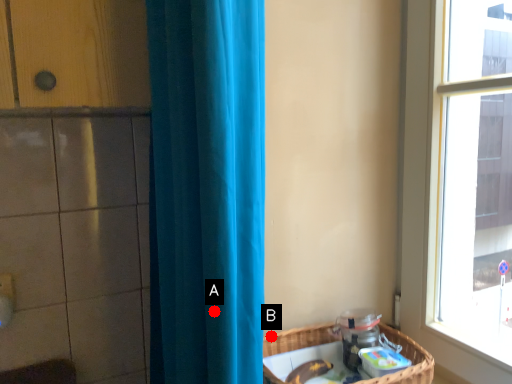
Question: Two points are circled on the image, labeled by A and B beside each circle. Which point appears closest to the camera in this image?

Choices:
 (A) A is closer
 (B) B is closer

Answer: (A)